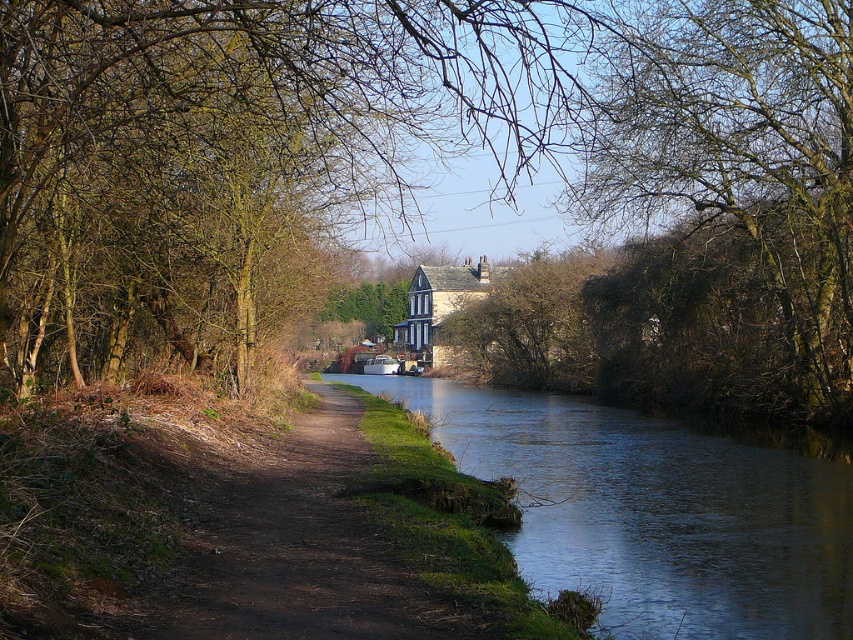
Question: Considering the real-world distances, which object is closest to the dark blue water at center?

Choices:
 (A) bare branches at center
 (B) brown dirt path at center

Answer: (B)

Question: Is bare branches at upper center wider than brown dirt path at center?

Choices:
 (A) no
 (B) yes

Answer: (B)

Question: Which point appears closest to the camera in this image?

Choices:
 (A) (679, 525)
 (B) (328, 390)

Answer: (A)

Question: Can you confirm if dark blue water at center is smaller than brown dirt path at center?

Choices:
 (A) yes
 (B) no

Answer: (B)

Question: Is bare branches at upper center positioned in front of brown dirt path at center?

Choices:
 (A) no
 (B) yes

Answer: (A)

Question: Based on their relative distances, which object is nearer to the bare branches at upper center?

Choices:
 (A) brown dirt path at center
 (B) bare branches at center

Answer: (B)